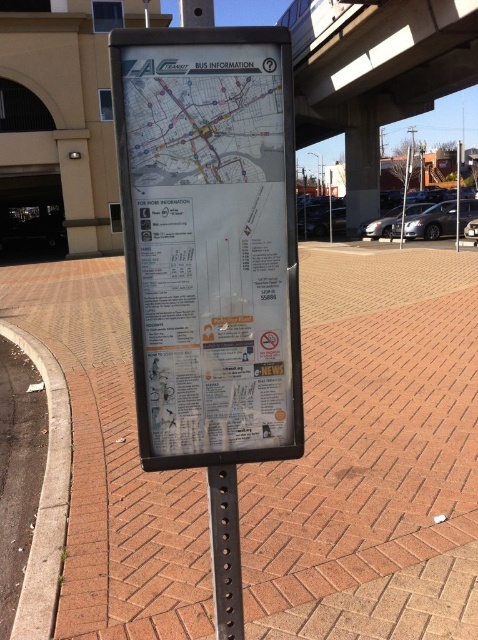
The height and width of the screenshot is (640, 478). What do you see at coordinates (209, 243) in the screenshot? I see `white plastic map at center` at bounding box center [209, 243].

Is white plastic map at center smaller than black metal pole at center?

No, white plastic map at center is not smaller than black metal pole at center.

Image resolution: width=478 pixels, height=640 pixels. Describe the element at coordinates (209, 243) in the screenshot. I see `white plastic map at center` at that location.

The height and width of the screenshot is (640, 478). I want to click on white plastic map at center, so click(x=209, y=243).

Between point (420, 288) and point (221, 637), which one is positioned behind?

Point (420, 288)

Is point (386, 636) behind point (225, 525)?

Yes, point (386, 636) is farther from viewer.

What do you see at coordinates (373, 456) in the screenshot? Image resolution: width=478 pixels, height=640 pixels. I see `brick pavement at center` at bounding box center [373, 456].

Locate an element on the screen. The height and width of the screenshot is (640, 478). brick pavement at center is located at coordinates (373, 456).

Does brick pavement at center have a larger size compared to white plastic map at center?

Yes, brick pavement at center is bigger than white plastic map at center.

Can you confirm if brick pavement at center is wider than white plastic map at center?

Correct, the width of brick pavement at center exceeds that of white plastic map at center.

Is point (448, 380) positioned in front of point (278, 257)?

No, it is behind (278, 257).

Identify the location of brick pavement at center. (373, 456).